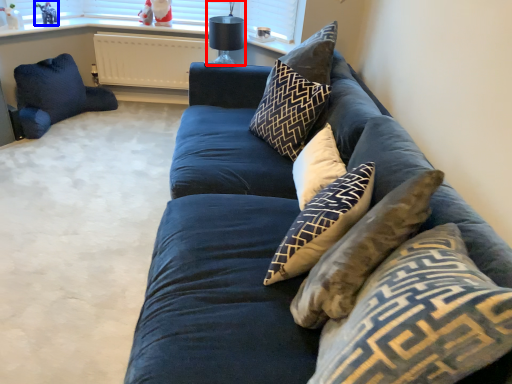
Question: Among these objects, which one is farthest to the camera, lamp (highlighted by a red box) or toy (highlighted by a blue box)?

Choices:
 (A) lamp
 (B) toy

Answer: (B)